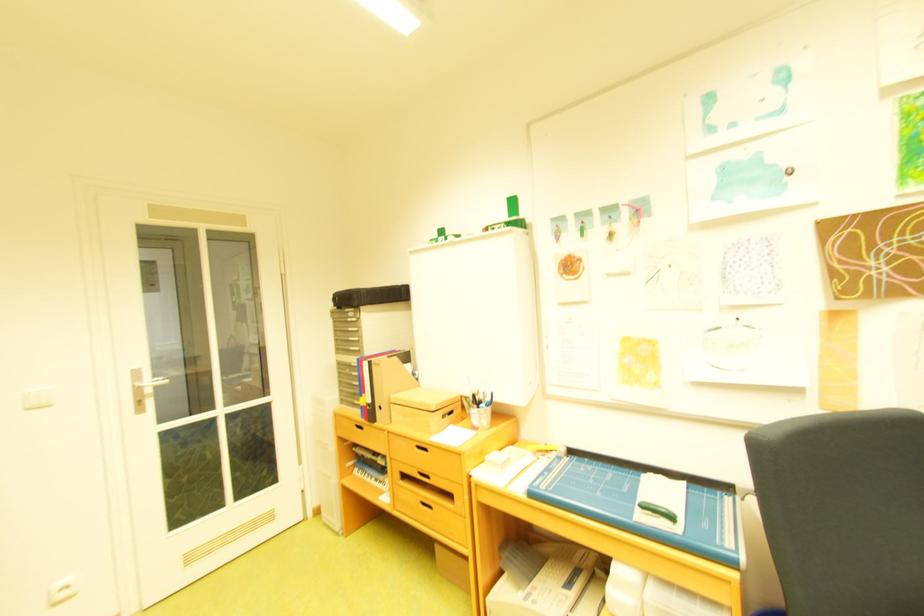
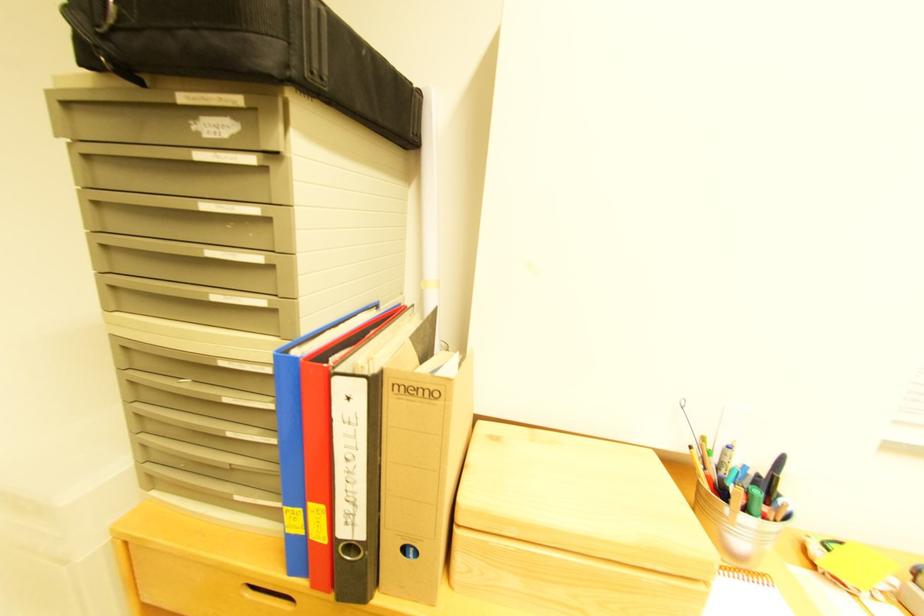
Find the pixel in the second image that matches point (363, 365) in the first image.

(235, 363)